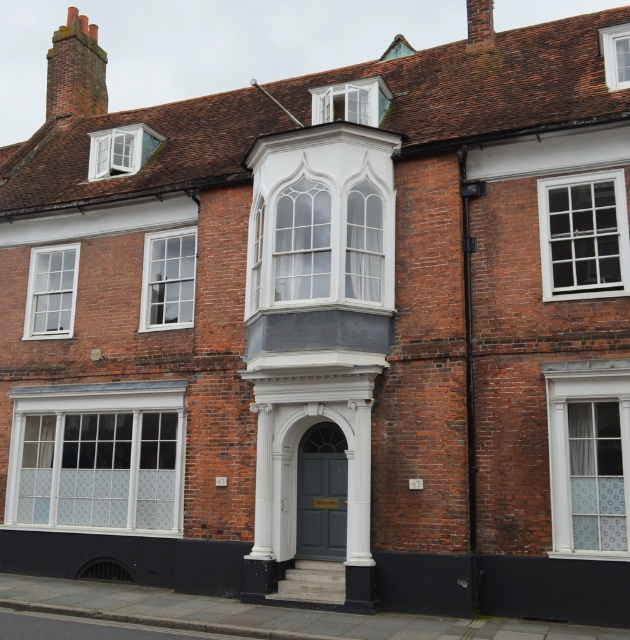
Which is more to the right, white textured glass at center or white glass window at center?

white textured glass at center is more to the right.

Is point (576, 532) more distant than point (193, 288)?

That is False.

Where is `white textured glass at center`? This screenshot has width=630, height=640. white textured glass at center is located at coordinates (588, 456).

Can you confirm if white textured glass at center is positioned to the left of clear glass window at center?

Indeed, white textured glass at center is positioned on the left side of clear glass window at center.

Can you confirm if white textured glass at center is positioned below clear glass window at center?

Yes.

Between point (576, 413) and point (570, 259), which one is positioned in front?

Point (576, 413) is more forward.

Find the location of `white textured glass at center`. white textured glass at center is located at coordinates (588, 456).

Does satin glass window at center have a greater height compared to white glass window at center?

Yes, satin glass window at center is taller than white glass window at center.

Between satin glass window at center and white glass window at center, which one appears on the left side from the viewer's perspective?

satin glass window at center is more to the left.

Identify the location of satin glass window at center. (98, 456).